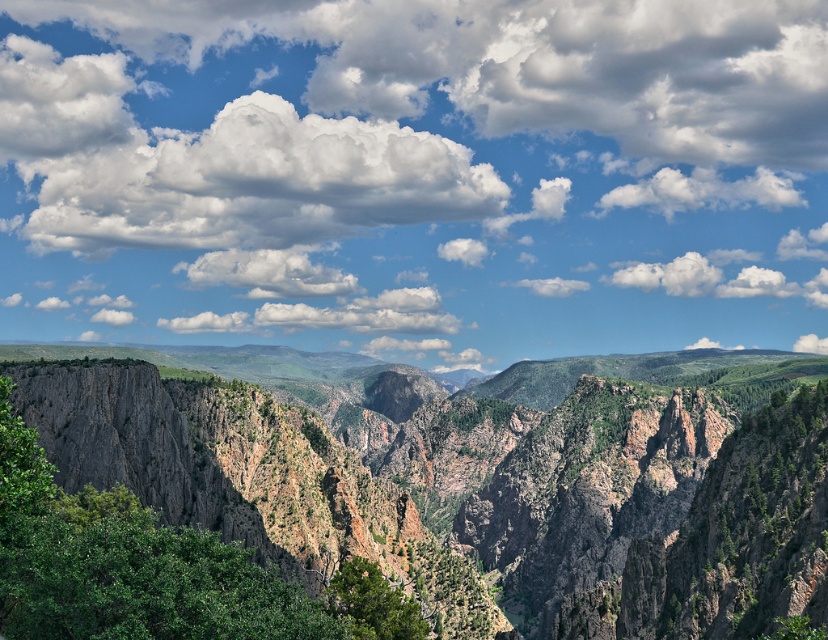
You are an outdoor photographer planning to capture the white fluffy cloud at upper center and the green textured tree at lower center in the same frame. Based on their positions, which object will appear larger in your photo?

The white fluffy cloud at upper center is further to the viewer than the green textured tree at lower center, so it will appear larger in the photo.

You are standing in the mountain valley and want to take a photo of both the green leafy tree at center and the green textured tree at lower center. Which tree should you focus on first to ensure both are in sharp focus?

You should focus on the green textured tree at lower center first because it is farther away from you than the green leafy tree at center, so adjusting focus from far to near helps ensure both are in sharp focus.